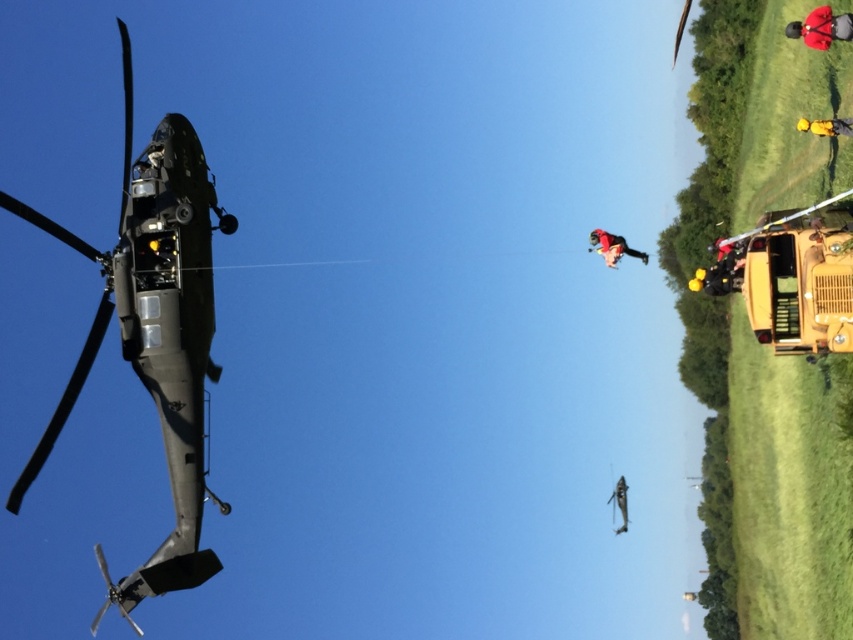
Question: Which object appears closest to the camera in this image?

Choices:
 (A) dark green military uniform at upper center
 (B) matte black helicopter at left
 (C) yellow hard hat at center
 (D) red fabric helmet at upper right

Answer: (C)

Question: From the image, what is the correct spatial relationship of matte black helicopter at left in relation to red fabric helmet at upper right?

Choices:
 (A) left
 (B) right

Answer: (A)

Question: Which of the following is the farthest from the observer?

Choices:
 (A) (183, 349)
 (B) (624, 531)
 (C) (704, 275)
 (D) (606, 232)

Answer: (B)

Question: Observing the image, what is the correct spatial positioning of yellow hard hat at center in reference to red fabric person at upper right?

Choices:
 (A) above
 (B) below

Answer: (B)

Question: Is red fabric person at upper right smaller than dark green military uniform at upper center?

Choices:
 (A) no
 (B) yes

Answer: (A)

Question: Which of the following is the closest to the observer?

Choices:
 (A) (814, 124)
 (B) (610, 257)
 (C) (625, 488)
 (D) (126, 109)

Answer: (A)